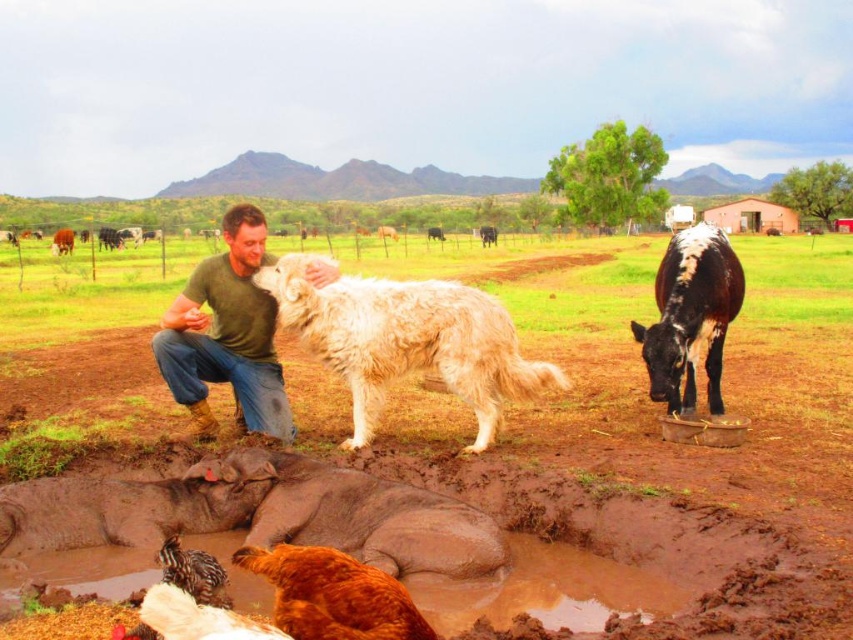
Question: Is brown soil at center positioned in front of brown fuzzy dog at lower center?

Choices:
 (A) no
 (B) yes

Answer: (B)

Question: Can you confirm if green matte shirt at center is thinner than speckled feathered chicken at lower left?

Choices:
 (A) yes
 (B) no

Answer: (B)

Question: Which point is farther to the camera?

Choices:
 (A) brown fuzzy dog at lower center
 (B) black and white cow at center
 (C) brown soil at center
 (D) white fluffy dog at center

Answer: (B)

Question: Can you confirm if brown soil at center is bigger than white fluffy dog at center?

Choices:
 (A) yes
 (B) no

Answer: (A)

Question: Among these points, which one is nearest to the camera?

Choices:
 (A) (368, 506)
 (B) (714, 388)

Answer: (A)

Question: Which point is farther from the camera taking this photo?

Choices:
 (A) (686, 454)
 (B) (192, 298)

Answer: (B)